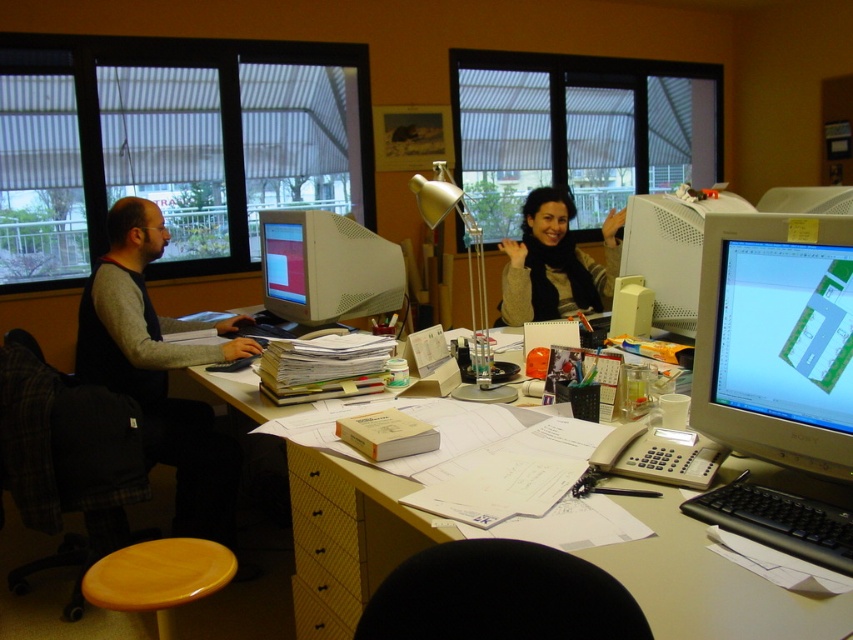
Does matte yellow desk at center have a greater height compared to matte black scarf at center?

No, matte yellow desk at center is not taller than matte black scarf at center.

What do you see at coordinates (715, 588) in the screenshot?
I see `matte yellow desk at center` at bounding box center [715, 588].

Find the location of a particular element. The image size is (853, 640). matte yellow desk at center is located at coordinates (715, 588).

Who is taller, matte yellow desk at center or white glossy computer monitor at center right?

Standing taller between the two is white glossy computer monitor at center right.

Which is below, matte yellow desk at center or white glossy computer monitor at center right?

matte yellow desk at center is below.

Where is `matte yellow desk at center`? matte yellow desk at center is located at coordinates (715, 588).

Can you confirm if white glossy monitor at right is positioned to the right of matte white monitor at upper right?

In fact, white glossy monitor at right is to the left of matte white monitor at upper right.

Does point (718, 289) lie behind point (780, 204)?

No, (718, 289) is in front of (780, 204).

Where is `white glossy monitor at right`? white glossy monitor at right is located at coordinates (776, 339).